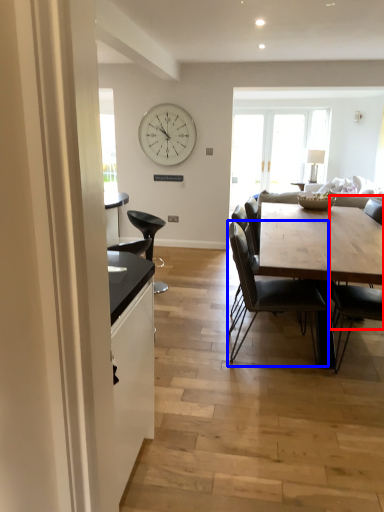
Question: Among these objects, which one is farthest to the camera, chair (highlighted by a red box) or chair (highlighted by a blue box)?

Choices:
 (A) chair
 (B) chair

Answer: (B)